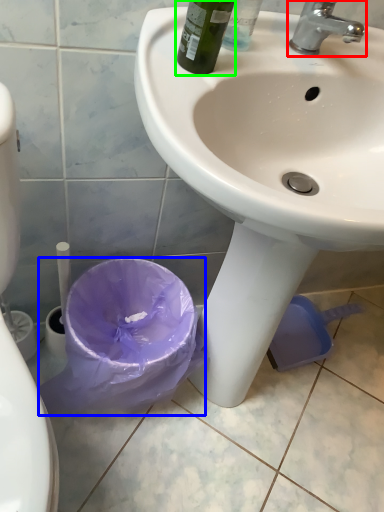
Question: Based on their relative distances, which object is farther from tap (highlighted by a red box)? Choose from garbage (highlighted by a blue box) and bottle (highlighted by a green box).

Choices:
 (A) garbage
 (B) bottle

Answer: (A)